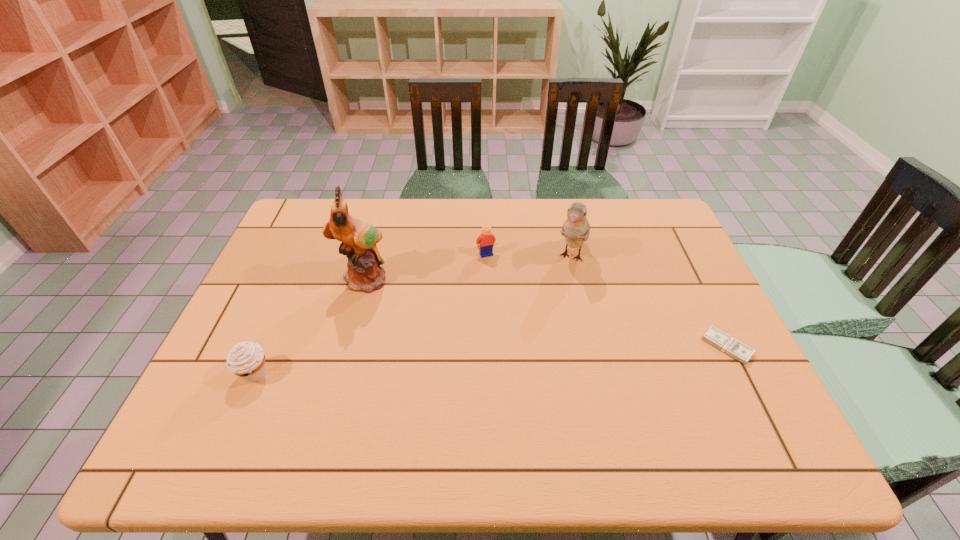
Identify the location of vacant space at the far right corner of the desktop. (660, 218).

This screenshot has height=540, width=960. I want to click on free space between the muffin and the second object from left to right, so click(x=309, y=326).

Locate an element on the screen. blank region between the second object from left to right and the leftmost object is located at coordinates (309, 326).

Locate an element on the screen. The height and width of the screenshot is (540, 960). free space between the money and the Lego is located at coordinates (607, 300).

Identify the location of empty space between the second tallest object and the third object from right to left. Image resolution: width=960 pixels, height=540 pixels. (529, 256).

The width and height of the screenshot is (960, 540). In order to click on free space between the leftmost object and the third object from left to right in this screenshot , I will do `click(371, 314)`.

The image size is (960, 540). Identify the location of free space between the third object from right to left and the shortest object. (607, 300).

Image resolution: width=960 pixels, height=540 pixels. Find the location of `vacant area that lies between the fourth object from left to right and the Lego`. vacant area that lies between the fourth object from left to right and the Lego is located at coordinates click(529, 256).

This screenshot has height=540, width=960. Identify the location of free space between the money and the Lego. (607, 300).

Identify the location of unoccupied area between the Lego and the fourth object from right to left. The image size is (960, 540). (424, 266).